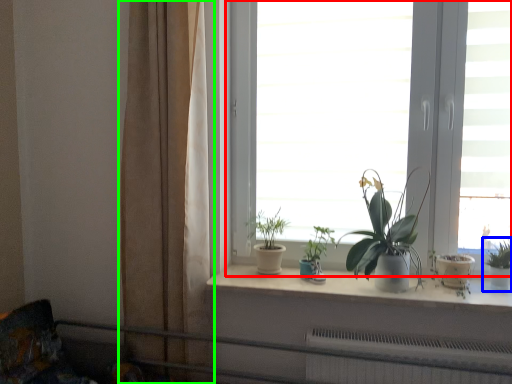
Question: Which object is the farthest from window (highlighted by a red box)? Choose among these: houseplant (highlighted by a blue box) or curtain (highlighted by a green box).

Choices:
 (A) houseplant
 (B) curtain

Answer: (A)